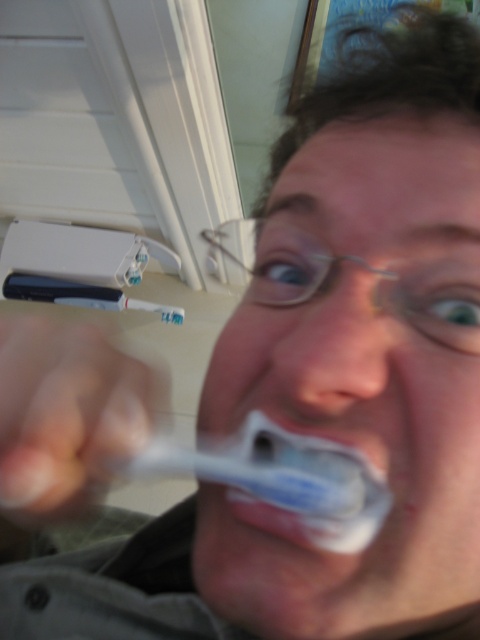
Is point (335, 500) positioned behind point (278, 456)?

No, (335, 500) is in front of (278, 456).

Does white soft toothbrush at center appear over white plastic toothbrush at center?

No.

Describe the element at coordinates (310, 488) in the screenshot. Image resolution: width=480 pixels, height=640 pixels. I see `white soft toothbrush at center` at that location.

The width and height of the screenshot is (480, 640). In order to click on white soft toothbrush at center in this screenshot , I will do `click(310, 488)`.